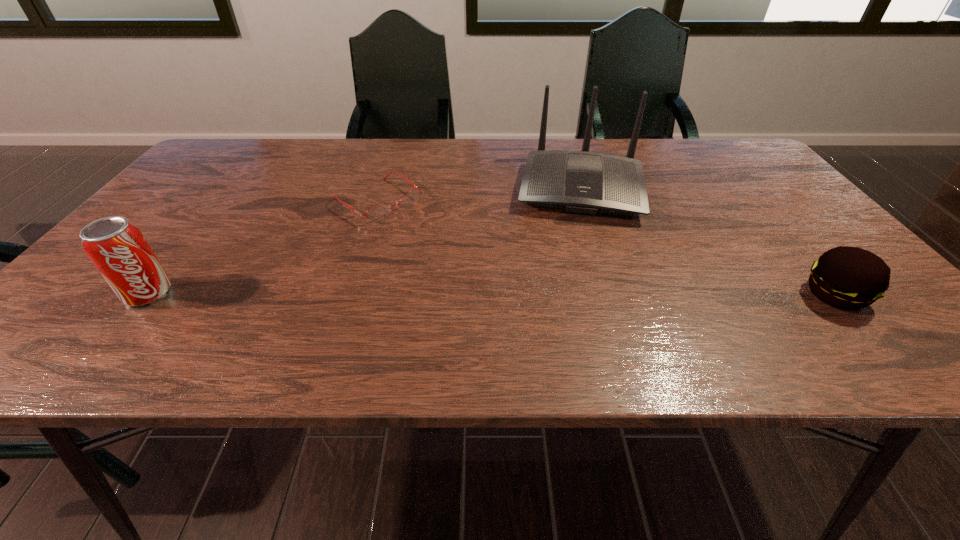
Identify the location of free space that satisfies the following two spatial constraints: 1. on the back side of the leftmost object; 2. on the left side of the spectacles. (223, 200).

Where is `vacant region that satisfies the following two spatial constraints: 1. on the front side of the third tallest object; 2. on the right side of the third object from right to left`? vacant region that satisfies the following two spatial constraints: 1. on the front side of the third tallest object; 2. on the right side of the third object from right to left is located at coordinates point(348,295).

In order to click on free point that satisfies the following two spatial constraints: 1. on the front side of the third object from left to right; 2. on the right side of the patty in this screenshot , I will do [x=614, y=295].

Where is `vacant space that satisfies the following two spatial constraints: 1. on the back side of the second object from right to left; 2. on the left side of the shortest object`? vacant space that satisfies the following two spatial constraints: 1. on the back side of the second object from right to left; 2. on the left side of the shortest object is located at coordinates (382, 188).

Identify the location of vacant space that satisfies the following two spatial constraints: 1. on the front side of the second shortest object; 2. on the right side of the leftmost object. point(147,295).